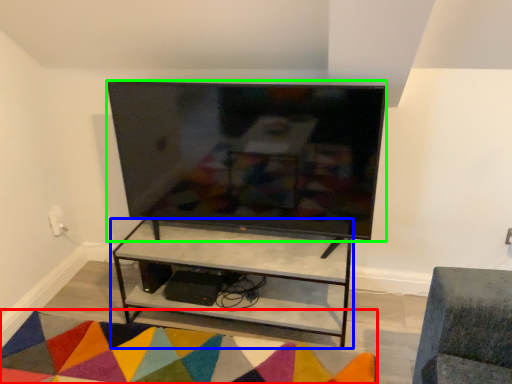
Question: Considering the real-world distances, which object is farthest from mat (highlighted by a red box)? shelf (highlighted by a blue box) or television (highlighted by a green box)?

Choices:
 (A) shelf
 (B) television

Answer: (B)